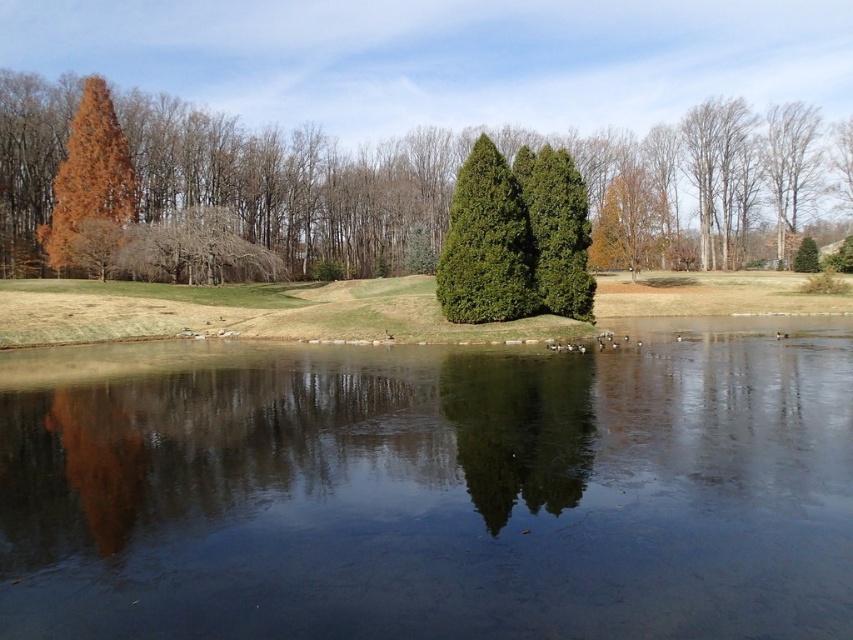
You are an ornithologist observing the landscape and want to place a bird feeder between the green textured cypress tree at center and the orange matte tree at lower left. Based on their positions, where should the feeder be placed to ensure it is between both trees?

The green textured cypress tree at center is located above the orange matte tree at lower left, so the bird feeder should be placed between them vertically, below the green textured cypress tree at center and above the orange matte tree at lower left.

You are standing at the center of the image and want to locate the green textured cypress tree at center. According to the coordinates given, where exactly should you look?

The green textured cypress tree at center is located at the 2D coordinates point (x=486, y=243).